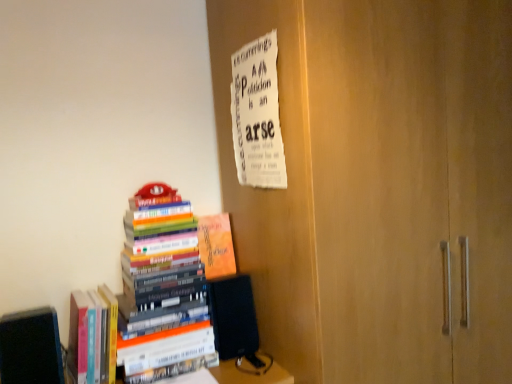
Question: From a real-world perspective, is white paper at upper center below hardcover books at left, which appears as the 3th book when viewed from the right?

Choices:
 (A) yes
 (B) no

Answer: (B)

Question: Considering the relative sizes of white paper at upper center and hardcover books at left, which appears as the 3th book when viewed from the right, in the image provided, is white paper at upper center smaller than hardcover books at left, which appears as the 3th book when viewed from the right,?

Choices:
 (A) no
 (B) yes

Answer: (B)

Question: Is white paper at upper center positioned far away from hardcover books at left, which appears as the 3th book when viewed from the right?

Choices:
 (A) yes
 (B) no

Answer: (B)

Question: From the image's perspective, is white paper at upper center below hardcover books at left, the second book in the left-to-right sequence?

Choices:
 (A) yes
 (B) no

Answer: (B)

Question: From a real-world perspective, does white paper at upper center stand above hardcover books at left, which appears as the 3th book when viewed from the right?

Choices:
 (A) no
 (B) yes

Answer: (B)

Question: Can we say white paper at upper center lies outside hardcover books at left, the second book in the left-to-right sequence?

Choices:
 (A) yes
 (B) no

Answer: (A)

Question: Is hardcover books at left, which appears as the 3th book when viewed from the right, in front of hardcover books at left, which is counted as the third book, starting from the left?

Choices:
 (A) no
 (B) yes

Answer: (A)

Question: From the image's perspective, is hardcover books at left, which appears as the 3th book when viewed from the right, above hardcover books at left, which is counted as the third book, starting from the left?

Choices:
 (A) no
 (B) yes

Answer: (A)

Question: Is hardcover books at left, which appears as the 3th book when viewed from the right, looking in the opposite direction of hardcover books at left, which is counted as the third book, starting from the left?

Choices:
 (A) no
 (B) yes

Answer: (A)

Question: Does hardcover books at left, the second book in the left-to-right sequence, have a lesser height compared to hardcover books at left, which is counted as the third book, starting from the left?

Choices:
 (A) no
 (B) yes

Answer: (B)

Question: Is hardcover books at left, which appears as the 3th book when viewed from the right, smaller than hardcover books at left, which appears as the second book when viewed from the right?

Choices:
 (A) yes
 (B) no

Answer: (A)

Question: Is there a large distance between hardcover books at left, which appears as the 3th book when viewed from the right, and hardcover books at left, which is counted as the third book, starting from the left?

Choices:
 (A) no
 (B) yes

Answer: (A)

Question: Can you confirm if hardcover books at left, which is counted as the third book, starting from the left, is wider than black matte book at lower left, marked as the first book in a left-to-right arrangement?

Choices:
 (A) yes
 (B) no

Answer: (A)